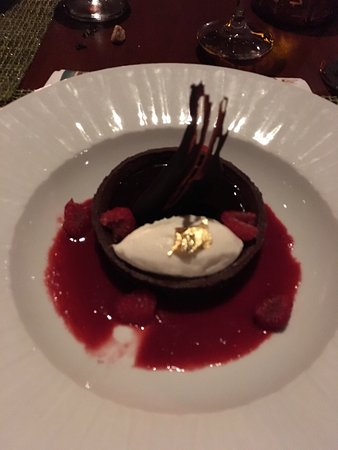
Locate an element on the screen. This screenshot has width=338, height=450. glass is located at coordinates (239, 46).